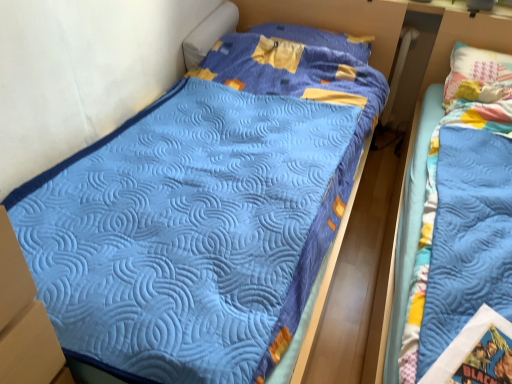
Question: Can you confirm if blue quilted pillow at upper center is taller than blue quilted bed at right?

Choices:
 (A) yes
 (B) no

Answer: (B)

Question: Is blue quilted pillow at upper center bigger than blue quilted bed at right?

Choices:
 (A) no
 (B) yes

Answer: (A)

Question: From the image's perspective, is blue quilted pillow at upper center on blue quilted bed at right?

Choices:
 (A) no
 (B) yes

Answer: (B)

Question: Does blue quilted pillow at upper center lie in front of blue quilted bed at right?

Choices:
 (A) no
 (B) yes

Answer: (A)

Question: Is blue quilted pillow at upper center oriented away from blue quilted bed at right?

Choices:
 (A) yes
 (B) no

Answer: (B)

Question: Considering the relative positions of blue quilted pillow at upper center and blue quilted bed at right in the image provided, is blue quilted pillow at upper center to the left of blue quilted bed at right from the viewer's perspective?

Choices:
 (A) no
 (B) yes

Answer: (B)

Question: From the image's perspective, is blue quilted bed at right on top of blue quilted pillow at upper center?

Choices:
 (A) no
 (B) yes

Answer: (A)

Question: Are blue quilted bed at right and blue quilted pillow at upper center far apart?

Choices:
 (A) no
 (B) yes

Answer: (A)

Question: From the image's perspective, does blue quilted bed at right appear lower than blue quilted pillow at upper center?

Choices:
 (A) no
 (B) yes

Answer: (B)

Question: Does blue quilted bed at right have a greater height compared to blue quilted pillow at upper center?

Choices:
 (A) yes
 (B) no

Answer: (A)

Question: Does blue quilted bed at right have a smaller size compared to blue quilted pillow at upper center?

Choices:
 (A) yes
 (B) no

Answer: (B)

Question: Could you tell me if blue quilted bed at right is facing blue quilted pillow at upper center?

Choices:
 (A) no
 (B) yes

Answer: (A)

Question: Is blue quilted pillow at upper center bigger or smaller than blue quilted bed at right?

Choices:
 (A) big
 (B) small

Answer: (B)